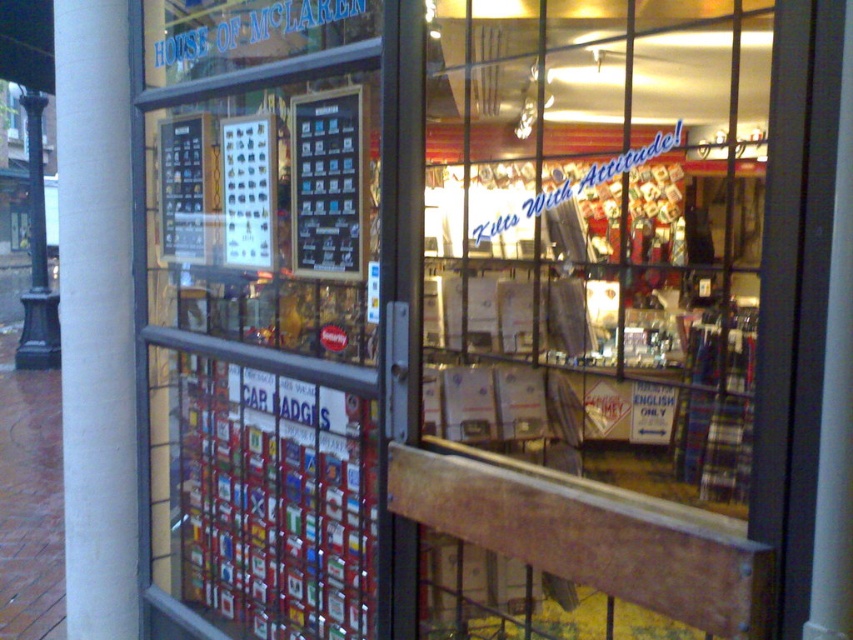
Based on the photo, can you confirm if white smooth pillar at left is positioned above metallic silver badge at center?

No, white smooth pillar at left is not above metallic silver badge at center.

Based on the photo, does white smooth pillar at left have a greater height compared to metallic silver badge at center?

Yes.

Is point (79, 483) positioned after point (308, 152)?

That is True.

Find the location of a particular element. white smooth pillar at left is located at coordinates (96, 317).

Who is taller, clear glass door at left or metallic silver badge at center?

clear glass door at left is taller.

Does clear glass door at left have a larger size compared to metallic silver badge at center?

Yes, clear glass door at left is bigger than metallic silver badge at center.

From the picture: Measure the distance between point (180, 230) and camera.

Point (180, 230) and camera are 2.70 meters apart.

You are a GUI agent. You are given a task and a screenshot of the screen. Output one action in this format:
    pyautogui.click(x=<x>, y=<y>)
    Task: Click on the clear glass door at left
    This screenshot has height=640, width=853.
    Given the screenshot: What is the action you would take?
    pyautogui.click(x=262, y=316)

Is transparent glass door at center positioned before clear glass door at left?

No, transparent glass door at center is behind clear glass door at left.

Which is below, transparent glass door at center or clear glass door at left?

clear glass door at left is below.

Between point (451, 368) and point (288, 6), which one is positioned in front?

Positioned in front is point (288, 6).

At what (x,y) coordinates should I click in order to perform the action: click on transparent glass door at center. Please return your answer as a coordinate pair (x, y). This screenshot has height=640, width=853. Looking at the image, I should click on (598, 237).